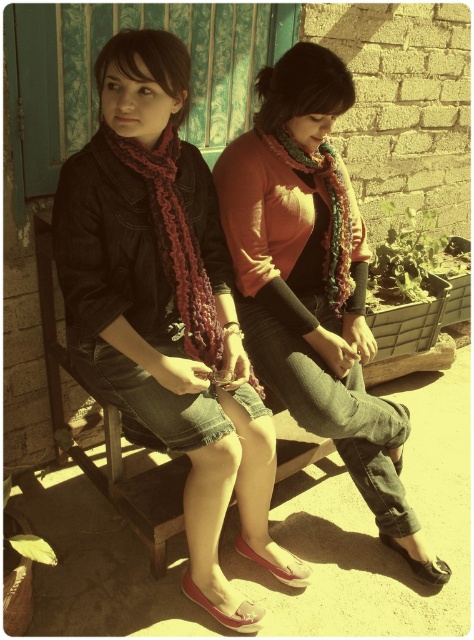
Does ruffled wool scarf at left appear under ruffled wool scarf at center?

Yes.

Between ruffled wool scarf at left and ruffled wool scarf at center, which one has more height?

With more height is ruffled wool scarf at left.

Find the location of a particular element. ruffled wool scarf at left is located at coordinates (164, 300).

This screenshot has height=640, width=474. What are the coordinates of `ruffled wool scarf at left` in the screenshot? It's located at (164, 300).

Which is in front, point (191, 422) or point (406, 556)?

Positioned in front is point (191, 422).

Between point (299, 564) and point (427, 561), which one is positioned behind?

The point (427, 561) is more distant.

The width and height of the screenshot is (474, 640). I want to click on ruffled wool scarf at left, so click(x=164, y=300).

Who is taller, ruffled wool scarf at left or knitted scarf at center?

Standing taller between the two is knitted scarf at center.

In the scene shown: Can you confirm if ruffled wool scarf at left is positioned below knitted scarf at center?

Yes, ruffled wool scarf at left is below knitted scarf at center.

Who is more forward, (196, 280) or (365, 260)?

Positioned in front is point (196, 280).

Identify the location of ruffled wool scarf at left. This screenshot has height=640, width=474. (164, 300).